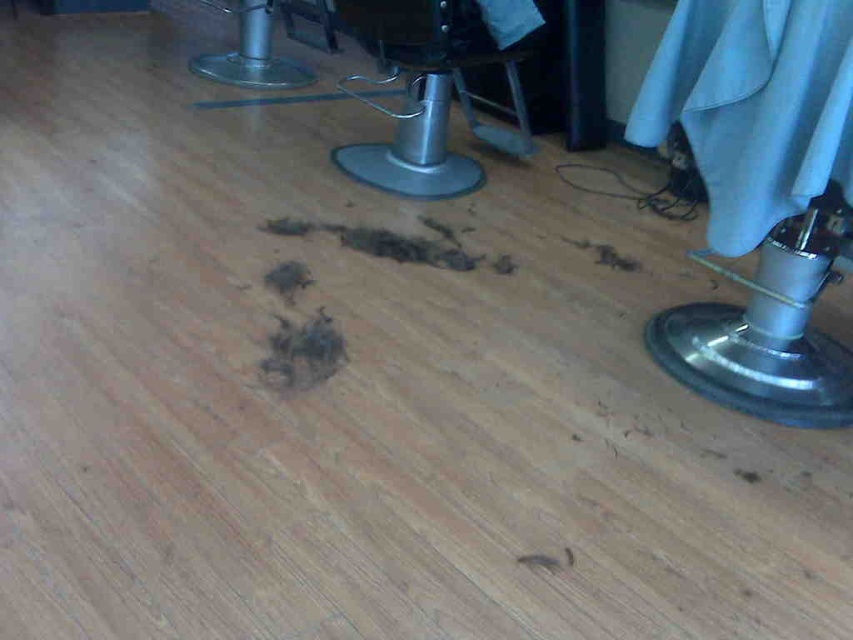
Question: Where is dark brown fur at center located in relation to brown fur at center in the image?

Choices:
 (A) above
 (B) below

Answer: (B)

Question: Which point is closer to the camera taking this photo?

Choices:
 (A) (428, 68)
 (B) (335, 364)

Answer: (B)

Question: Is dark brown fur at center above brown fur at center?

Choices:
 (A) yes
 (B) no

Answer: (B)

Question: Among these points, which one is nearest to the camera?

Choices:
 (A) click(x=341, y=348)
 (B) click(x=309, y=280)
 (C) click(x=434, y=74)

Answer: (A)

Question: Considering the relative positions of metallic silver chair at center and brown fur at center in the image provided, where is metallic silver chair at center located with respect to brown fur at center?

Choices:
 (A) below
 (B) above

Answer: (B)

Question: Which is farther from the metallic silver chair at center?

Choices:
 (A) dark brown fur at center
 (B) brown fur at center

Answer: (A)